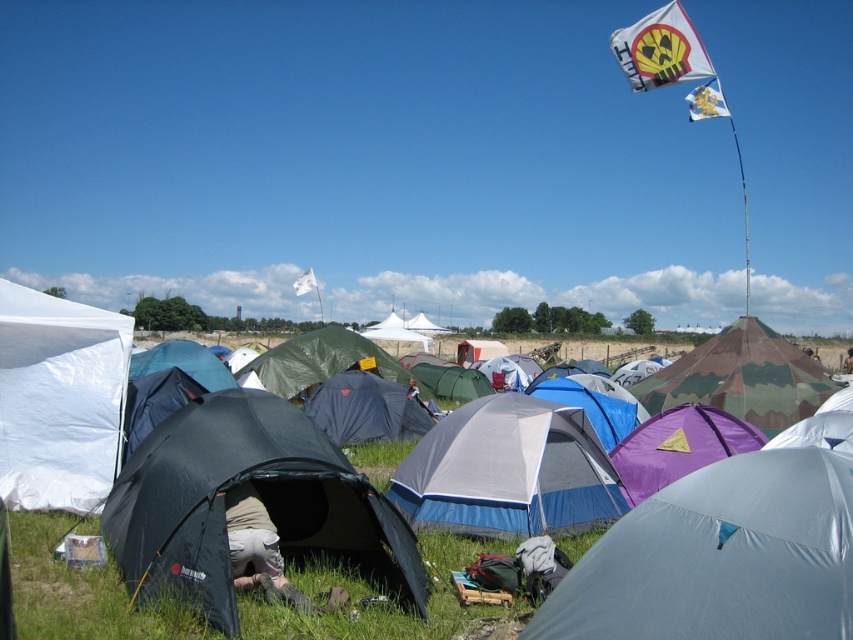
You are a hiker who needs to place a 2.5 meter long tent pole between the matte gray tent at center and the khaki fabric pants at center. Is there enough space to place it horizontally between them?

The distance between the matte gray tent at center and the khaki fabric pants at center is 2.68 meters, which is slightly longer than the 2.5 meter tent pole. Therefore, there is enough space to place it horizontally between them.